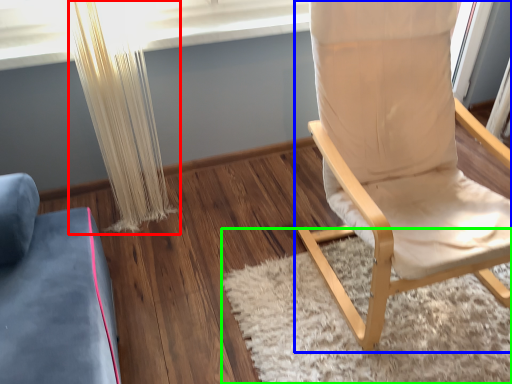
Question: Estimate the real-world distances between objects in this image. Which object is closer to curtain (highlighted by a red box), chair (highlighted by a blue box) or mat (highlighted by a green box)?

Choices:
 (A) chair
 (B) mat

Answer: (B)